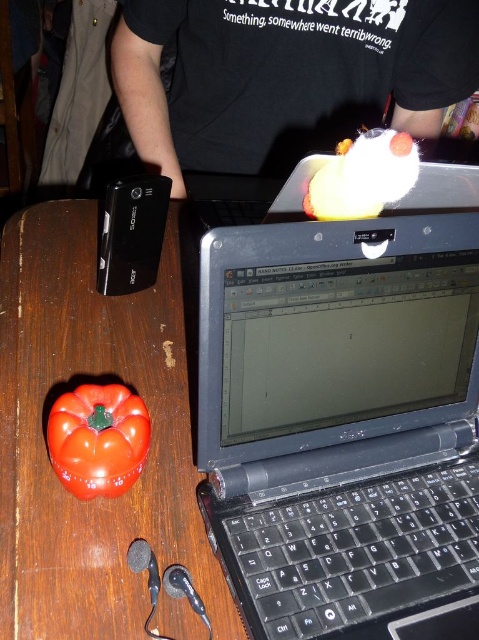
Question: Which object is farther from the camera taking this photo?

Choices:
 (A) black cotton shirt at upper center
 (B) black plastic laptop at upper center
 (C) shiny plastic bell pepper at lower left
 (D) white fluffy cloud at upper center

Answer: (A)

Question: From the image, what is the correct spatial relationship of shiny plastic bell pepper at lower left in relation to white fluffy cloud at upper center?

Choices:
 (A) below
 (B) above

Answer: (A)

Question: Is black plastic laptop at upper center smaller than shiny plastic bell pepper at lower left?

Choices:
 (A) yes
 (B) no

Answer: (B)

Question: Which point is farther from the camera taking this photo?

Choices:
 (A) (371, 141)
 (B) (63, 465)
 (C) (343, 122)

Answer: (C)

Question: Which is farther from the black plastic laptop at upper center?

Choices:
 (A) white fluffy cloud at upper center
 (B) black cotton shirt at upper center
 (C) shiny plastic bell pepper at lower left

Answer: (B)

Question: Can you confirm if black plastic laptop at upper center is bigger than black cotton shirt at upper center?

Choices:
 (A) no
 (B) yes

Answer: (A)